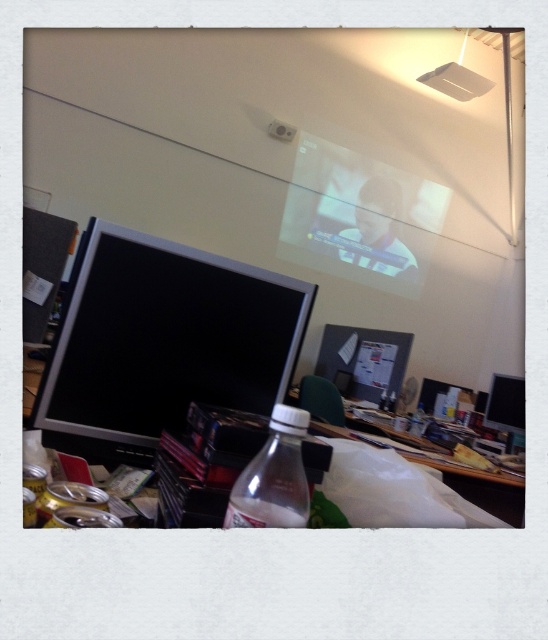
Question: Among these objects, which one is farthest from the camera?

Choices:
 (A) clear plastic bottle at lower center
 (B) translucent plastic table at center

Answer: (B)

Question: Can you confirm if clear plastic bottle at lower center is thinner than black glossy monitor at right?

Choices:
 (A) no
 (B) yes

Answer: (B)

Question: Which object appears farthest from the camera in this image?

Choices:
 (A) translucent plastic table at center
 (B) black glossy monitor at right
 (C) satin black monitor at center

Answer: (B)

Question: Is clear plastic bottle at lower center positioned in front of translucent plastic table at center?

Choices:
 (A) no
 (B) yes

Answer: (B)

Question: Does satin black monitor at center have a lesser width compared to matte black monitor at center?

Choices:
 (A) no
 (B) yes

Answer: (B)

Question: Which point is farther to the camera?

Choices:
 (A) (493, 387)
 (B) (522, 524)
 (C) (295, 419)
 (D) (333, 346)

Answer: (D)